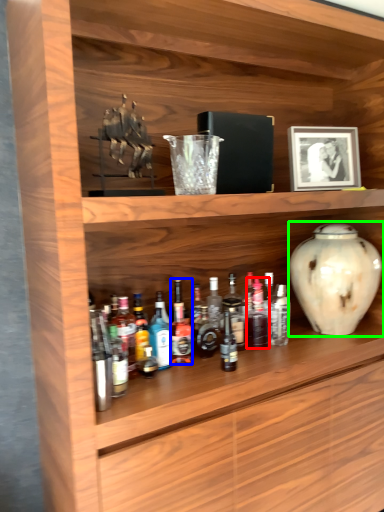
Question: Estimate the real-world distances between objects in this image. Which object is farther from bottle (highlighted by a red box), bottle (highlighted by a blue box) or vase (highlighted by a green box)?

Choices:
 (A) bottle
 (B) vase

Answer: (A)